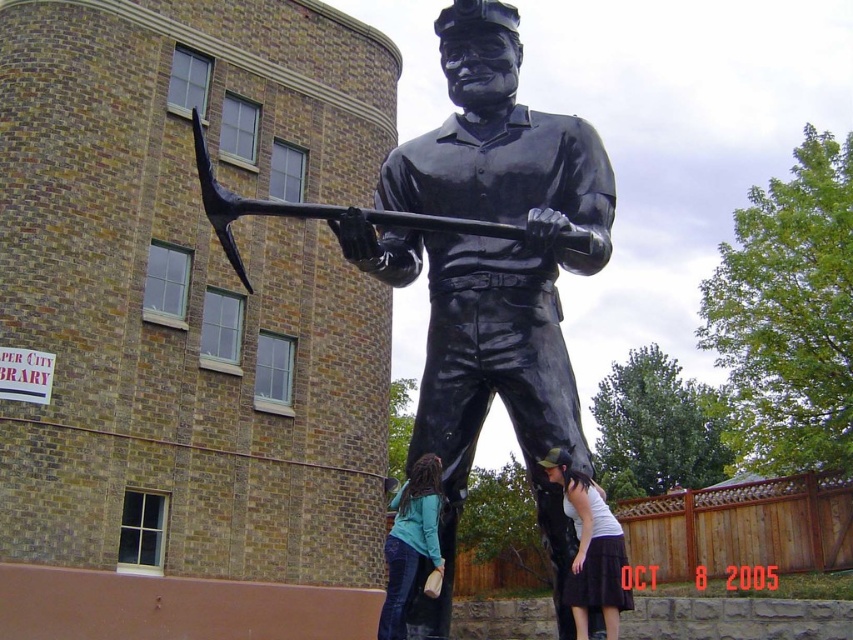
You are an artist planning to sketch this scene. You need to ensure the proportions between the black glossy statue at center and the denim pants at lower center are accurate. Which object should you draw wider in your sketch?

The black glossy statue at center should be drawn wider than the denim pants at lower center because its width surpasses the denim pants at lower center.

You are an artist planning to sketch the statue in the image. You want to focus on the white fabric shirt at lower center and the black glossy pickaxe at center. Which object should you draw first if you want to start with the one that takes up more space in the image?

The black glossy pickaxe at center takes up more space than the white fabric shirt at lower center, so you should start by drawing the black glossy pickaxe at center first.